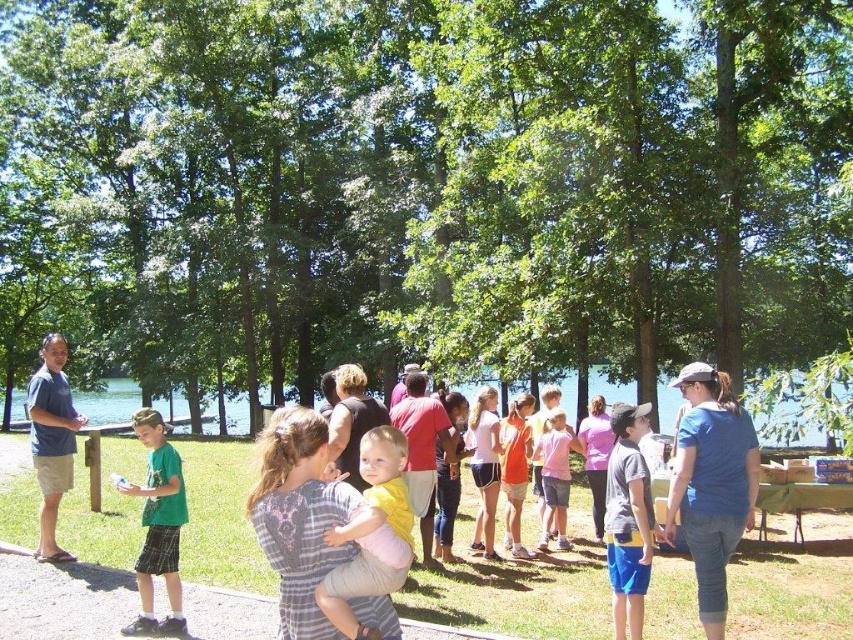
You are standing at the picnic table covered with a green cloth and looking towards the yellow fabric shirt at center. Which direction should you turn to face the point located at coordinate [370,534]?

The point at coordinate [370,534] corresponds to the yellow fabric shirt at center, so you are already facing it. No need to turn.